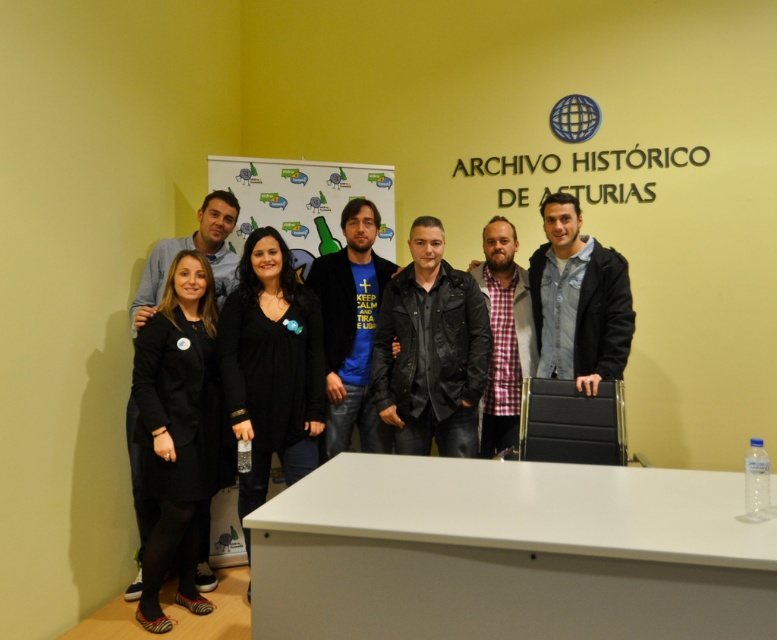
Looking at this image, you are a photographer standing in front of the white desk with a water bottle on its right side. You need to position a black matte dress at center and a matte plastic bulletin board at center so that they are exactly 75 centimeters apart. Based on the current setup, do you need to move them closer or farther apart?

The black matte dress at center is currently 74.96 centimeters from the matte plastic bulletin board at center. Since 74.96 cm is slightly less than 75 cm, you need to move them slightly farther apart to reach the desired distance.

You are standing at the point labeled as point (389, 273) and want to move to the water bottle on the desk. The point labeled as point (145, 614) is blocking your path. Can you walk around it to reach the water bottle?

Point (145, 614) is in front of point (389, 273), so you can walk around it to reach the water bottle.